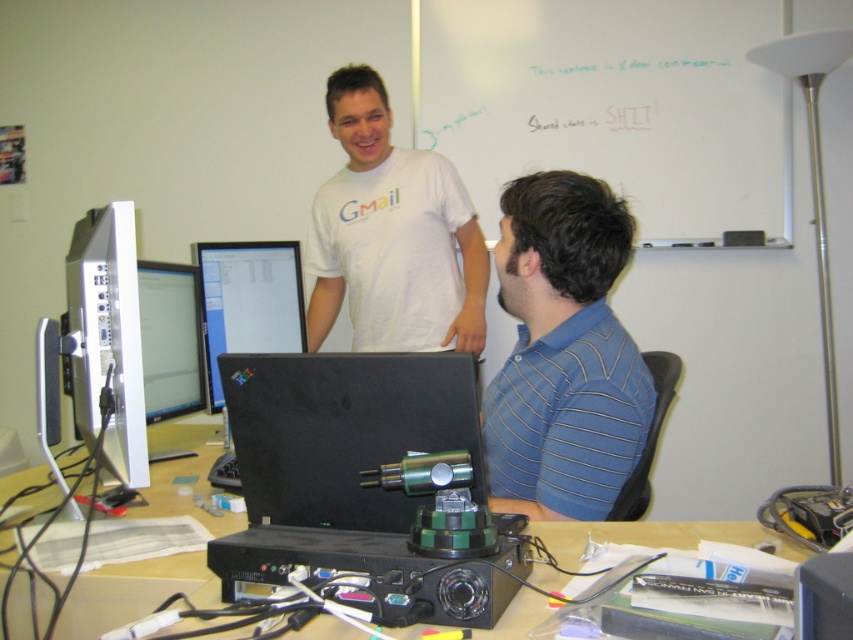
You are standing in the office scene described. You need to locate the whiteboard at upper center and the blue striped shirt at right. From the perspective of someone facing the scene, which object is positioned to the left?

The blue striped shirt at right is to the left of the whiteboard at upper center because the whiteboard at upper center is to the right of the blue striped shirt at right.

You are organizing the desk and need to place a new item between the blue striped shirt at right and the matte black monitor at center. Based on their positions, where should you place the item?

The blue striped shirt at right is to the right of the matte black monitor at center, so placing the new item between them would require positioning it to the left of the blue striped shirt at right and to the right of the matte black monitor at center.